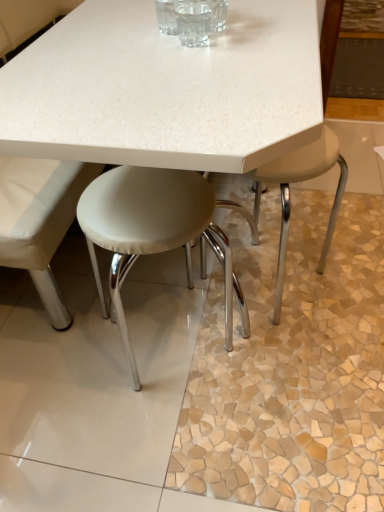
Image resolution: width=384 pixels, height=512 pixels. I want to click on vacant point to the right of white leather stool at center, which is the 1th stool in left-to-right order, so point(276,366).